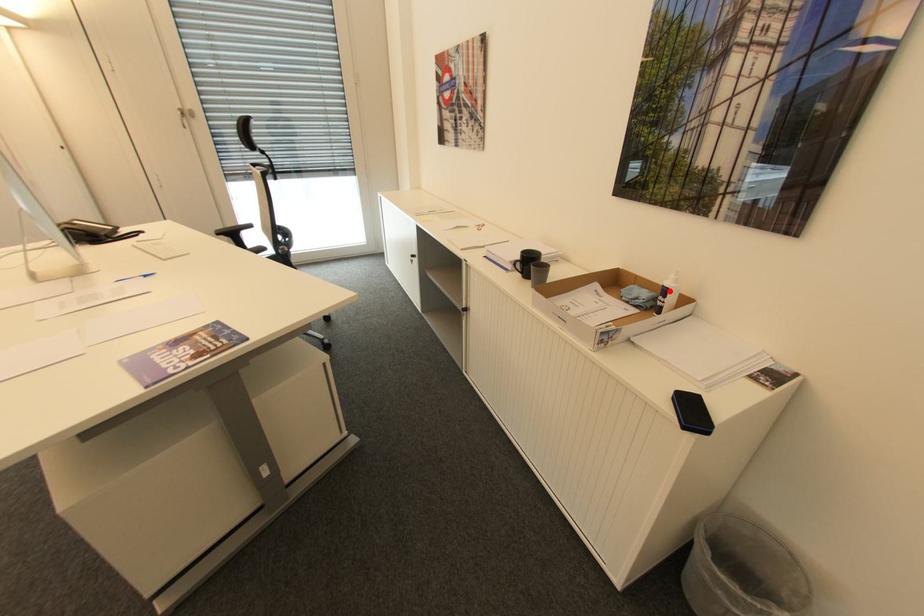
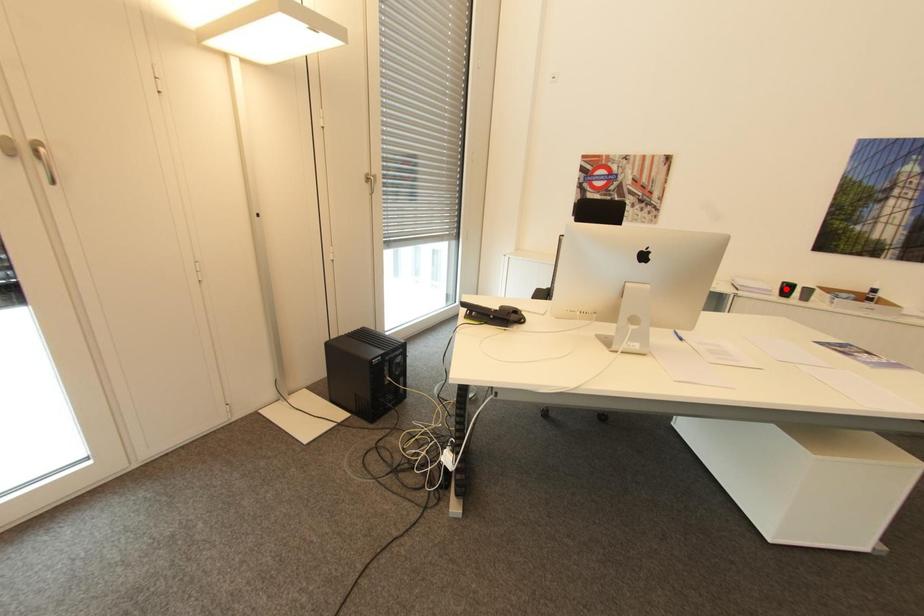
I am providing you with two images of the same scene from different viewpoints. A red point is marked on the first image and another point is marked on the second image. Is the red point in image1 aligned with the point shown in image2?

No